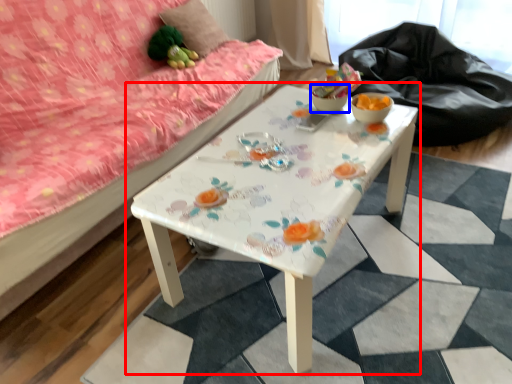
Question: Among these objects, which one is farthest to the camera, table (highlighted by a red box) or glass bowl (highlighted by a blue box)?

Choices:
 (A) table
 (B) glass bowl

Answer: (B)